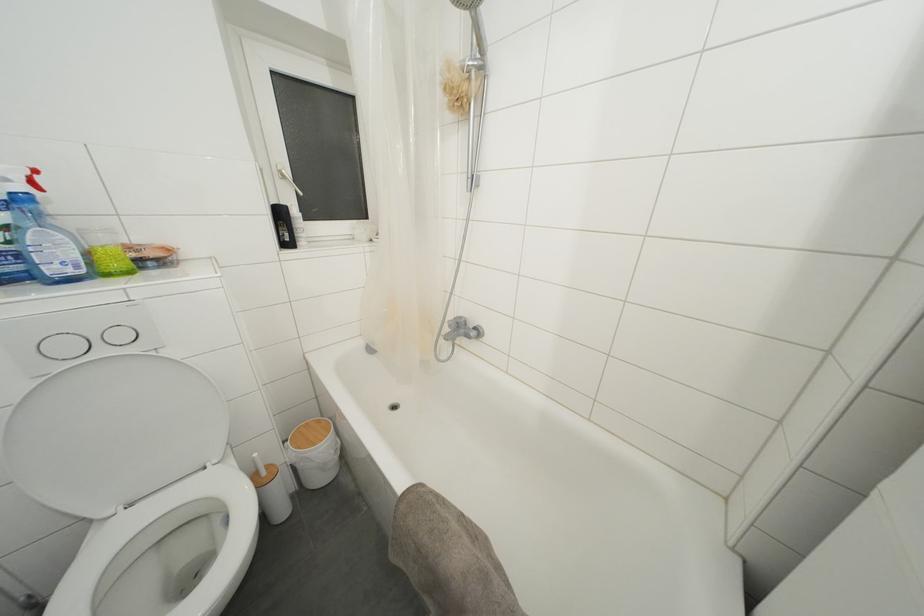
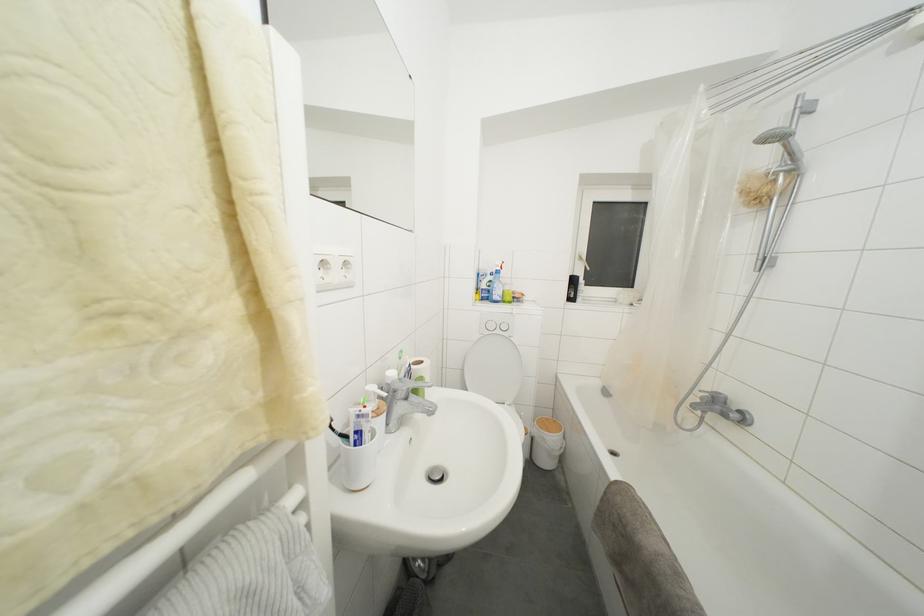
Where in the second image is the point corresponding to point (156, 265) from the first image?

(520, 304)